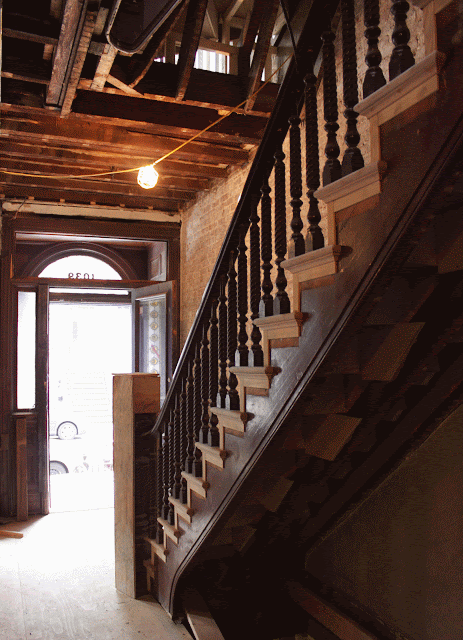
Find the location of `under the stairs`. under the stairs is located at coordinates (413, 312).